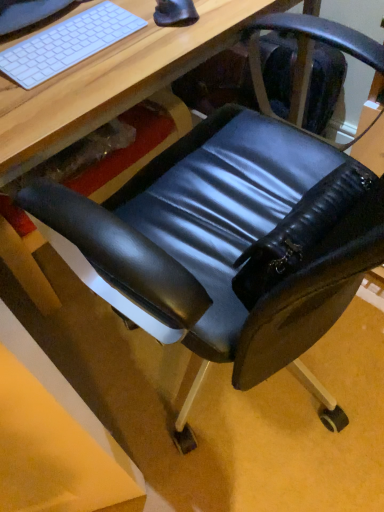
Locate an element on the screen. The width and height of the screenshot is (384, 512). matte black chair at lower right is located at coordinates (124, 78).

What do you see at coordinates (67, 44) in the screenshot?
I see `white matte keyboard at upper left` at bounding box center [67, 44].

Identify the location of black rubber mouse at upper center. (175, 13).

The height and width of the screenshot is (512, 384). Describe the element at coordinates (230, 240) in the screenshot. I see `black leather swivel chair at center` at that location.

Where is `matte black chair at lower right`? matte black chair at lower right is located at coordinates click(124, 78).

Is black leather swivel chair at center placed right next to black rubber mouse at upper center?

black leather swivel chair at center is not next to black rubber mouse at upper center, and they're not touching.

Considering the positions of points (298, 355) and (170, 4), is point (298, 355) closer to camera compared to point (170, 4)?

No, it is behind (170, 4).

Which object is more forward, black leather swivel chair at center or black rubber mouse at upper center?

black leather swivel chair at center is more forward.

Is point (17, 109) more distant than point (68, 60)?

No, it is in front of (68, 60).

Is white matte keyboard at upper left surrounded by matte black chair at lower right?

Yes, white matte keyboard at upper left is a part of matte black chair at lower right.

Is matte black chair at lower right facing away from white matte keyboard at upper left?

matte black chair at lower right does not have its back to white matte keyboard at upper left.

Is matte black chair at lower right next to white matte keyboard at upper left?

Yes, matte black chair at lower right is in contact with white matte keyboard at upper left.

In the scene shown: Do you think matte black chair at lower right is within black rubber mouse at upper center, or outside of it?

matte black chair at lower right cannot be found inside black rubber mouse at upper center.

In terms of width, does matte black chair at lower right look wider or thinner when compared to black rubber mouse at upper center?

Clearly, matte black chair at lower right has more width compared to black rubber mouse at upper center.

Can you confirm if matte black chair at lower right is positioned to the right of black rubber mouse at upper center?

In fact, matte black chair at lower right is to the left of black rubber mouse at upper center.

Which object is closer to the camera taking this photo, matte black chair at lower right or black rubber mouse at upper center?

matte black chair at lower right is more forward.

Which object is thinner, black leather swivel chair at center or matte black chair at lower right?

matte black chair at lower right is thinner.

Which is behind, point (171, 274) or point (53, 141)?

Positioned behind is point (53, 141).

In the scene shown: How many degrees apart are the facing directions of black leather swivel chair at center and matte black chair at lower right?

179 degrees separate the facing orientations of black leather swivel chair at center and matte black chair at lower right.

In the scene shown: Relative to matte black chair at lower right, is black leather swivel chair at center in front or behind?

black leather swivel chair at center is positioned farther from the viewer than matte black chair at lower right.

From the image's perspective, would you say white matte keyboard at upper left is shown under black leather swivel chair at center?

Incorrect, from the image's perspective, white matte keyboard at upper left is higher than black leather swivel chair at center.

Image resolution: width=384 pixels, height=512 pixels. What are the coordinates of `computer keyboard located on the left of black leather swivel chair at center` in the screenshot? It's located at (67, 44).

Looking at this image, is white matte keyboard at upper left facing away from black leather swivel chair at center?

white matte keyboard at upper left is not turned away from black leather swivel chair at center.

From a real-world perspective, is white matte keyboard at upper left on top of black leather swivel chair at center?

Indeed, from a real-world perspective, white matte keyboard at upper left stands above black leather swivel chair at center.

Considering the positions of point (175, 1) and point (36, 81), is point (175, 1) closer or farther from the camera than point (36, 81)?

Clearly, point (175, 1) is more distant from the camera than point (36, 81).

Is black rubber mouse at upper center wider or thinner than white matte keyboard at upper left?

In the image, black rubber mouse at upper center appears to be more narrow than white matte keyboard at upper left.

From a real-world perspective, who is located lower, black rubber mouse at upper center or white matte keyboard at upper left?

From a 3D spatial view, white matte keyboard at upper left is below.

Considering the positions of points (106, 38) and (185, 0), is point (106, 38) farther from camera compared to point (185, 0)?

No, it is in front of (185, 0).

Considering the positions of objects white matte keyboard at upper left and black rubber mouse at upper center in the image provided, who is more to the right, white matte keyboard at upper left or black rubber mouse at upper center?

Positioned to the right is black rubber mouse at upper center.

Is white matte keyboard at upper left positioned far away from black rubber mouse at upper center?

white matte keyboard at upper left is near black rubber mouse at upper center, not far away.

Where is `swivel chair that appears below the black rubber mouse at upper center (from the image's perspective)`? swivel chair that appears below the black rubber mouse at upper center (from the image's perspective) is located at coordinates (230, 240).

What are the coordinates of `computer keyboard that appears above the matte black chair at lower right (from the image's perspective)` in the screenshot? It's located at (67, 44).

From the image, which object appears to be farther from matte black chair at lower right, black leather swivel chair at center or white matte keyboard at upper left?

Among the two, black leather swivel chair at center is located further to matte black chair at lower right.

Based on their spatial positions, is black leather swivel chair at center or white matte keyboard at upper left further from black rubber mouse at upper center?

black leather swivel chair at center is further to black rubber mouse at upper center.

Estimate the real-world distances between objects in this image. Which object is closer to black leather swivel chair at center, matte black chair at lower right or black rubber mouse at upper center?

matte black chair at lower right lies closer to black leather swivel chair at center than the other object.

Considering their positions, is black rubber mouse at upper center positioned closer to white matte keyboard at upper left than black leather swivel chair at center?

The object closer to white matte keyboard at upper left is black rubber mouse at upper center.

Looking at the image, which one is located closer to white matte keyboard at upper left, black leather swivel chair at center or black rubber mouse at upper center?

The object closer to white matte keyboard at upper left is black rubber mouse at upper center.

Considering their positions, is matte black chair at lower right positioned further to black leather swivel chair at center than white matte keyboard at upper left?

white matte keyboard at upper left is further to black leather swivel chair at center.

Considering their positions, is black leather swivel chair at center positioned further to white matte keyboard at upper left than matte black chair at lower right?

black leather swivel chair at center is further to white matte keyboard at upper left.

When comparing their distances from matte black chair at lower right, does black leather swivel chair at center or black rubber mouse at upper center seem closer?

black rubber mouse at upper center is positioned closer to the anchor matte black chair at lower right.

You are a GUI agent. You are given a task and a screenshot of the screen. Output one action in this format:
    pyautogui.click(x=<x>, y=<y>)
    Task: Click on the computer keyboard between matte black chair at lower right and black rubber mouse at upper center from left to right
    
    Given the screenshot: What is the action you would take?
    pyautogui.click(x=67, y=44)

Image resolution: width=384 pixels, height=512 pixels. I want to click on desk between black rubber mouse at upper center and black leather swivel chair at center in the vertical direction, so tap(124, 78).

Find the location of a particular element. This screenshot has width=384, height=512. computer keyboard between black rubber mouse at upper center and black leather swivel chair at center vertically is located at coordinates (67, 44).

Find the location of `desk between white matte keyboard at upper left and black leather swivel chair at center vertically`. desk between white matte keyboard at upper left and black leather swivel chair at center vertically is located at coordinates (124, 78).